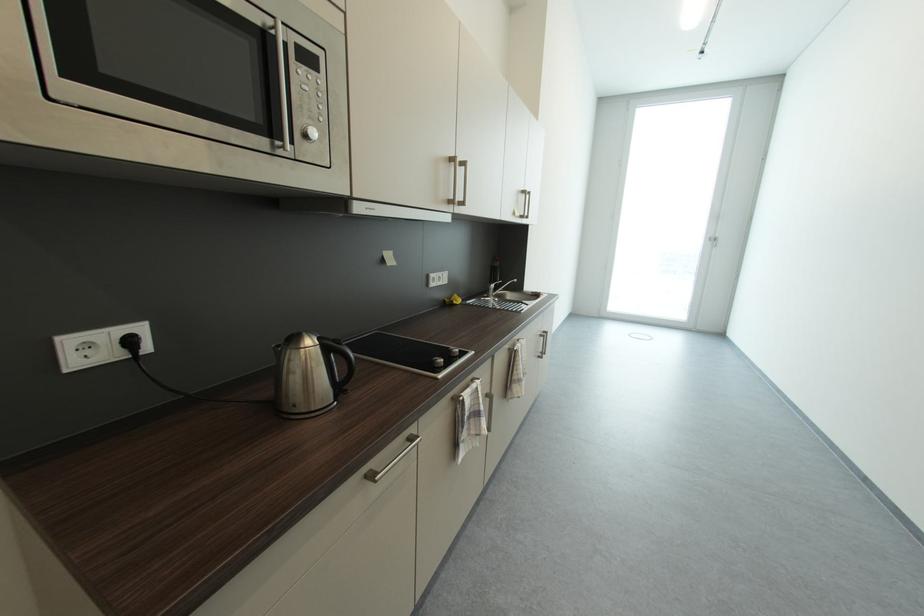
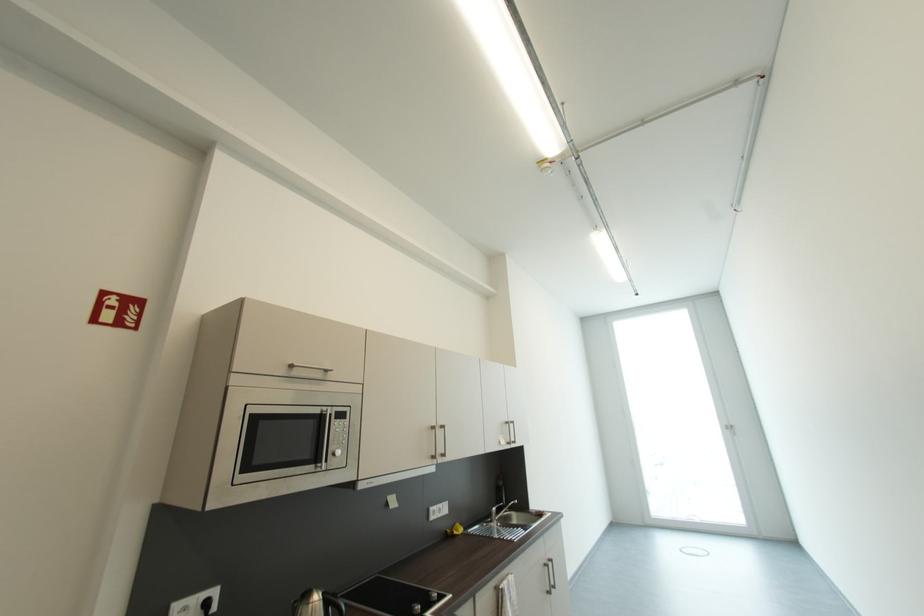
In the second image, find the point that corresponds to (137,344) in the first image.

(213, 605)